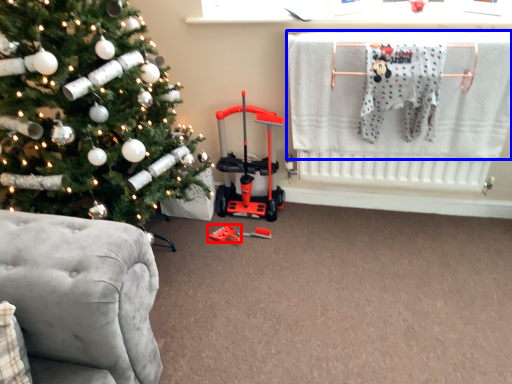
Question: Which point is closer to the camera, toy (highlighted by a red box) or laundry (highlighted by a blue box)?

Choices:
 (A) toy
 (B) laundry

Answer: (B)